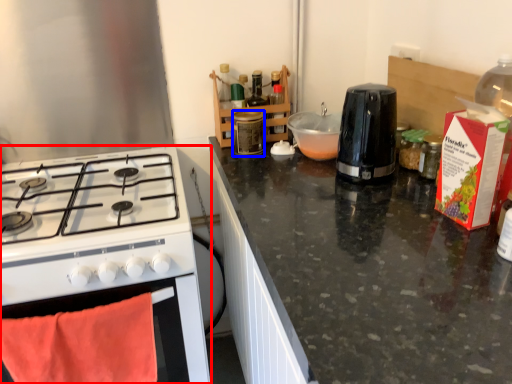
Question: Which point is further to the camera, kitchen appliance (highlighted by a red box) or bottle (highlighted by a blue box)?

Choices:
 (A) kitchen appliance
 (B) bottle

Answer: (B)